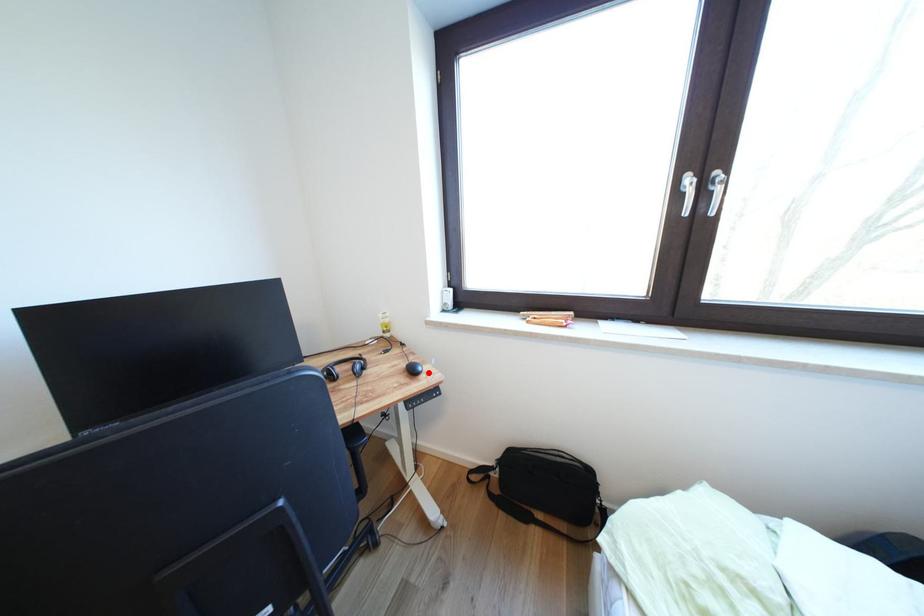
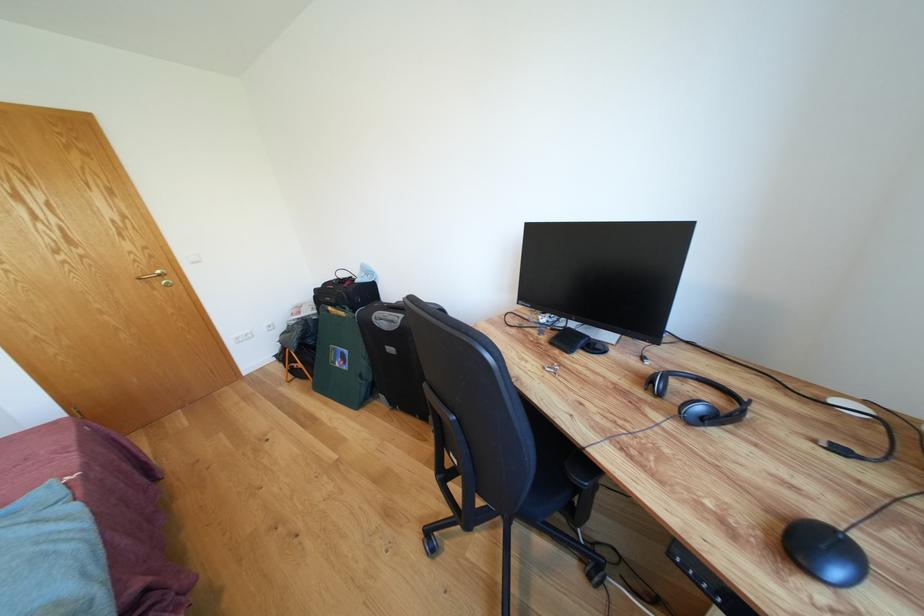
Where in the second image is the point corresponding to the highlighted location from the first image?

(844, 578)